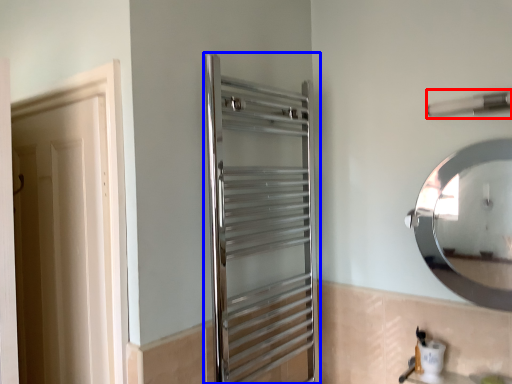
Question: Which object is closer to the camera taking this photo, towel bar (highlighted by a red box) or screen door (highlighted by a blue box)?

Choices:
 (A) towel bar
 (B) screen door

Answer: (B)